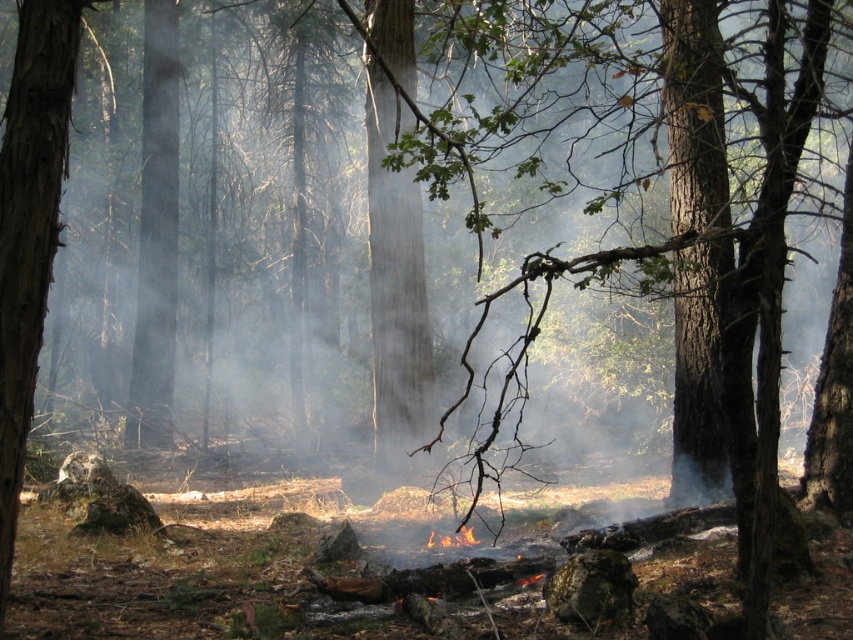
Who is taller, smooth bark tree at left or charred wood pile at center?

smooth bark tree at left

You are a GUI agent. You are given a task and a screenshot of the screen. Output one action in this format:
    pyautogui.click(x=<x>, y=<y>)
    Task: Click on the smooth bark tree at left
    
    Given the screenshot: What is the action you would take?
    pyautogui.click(x=28, y=228)